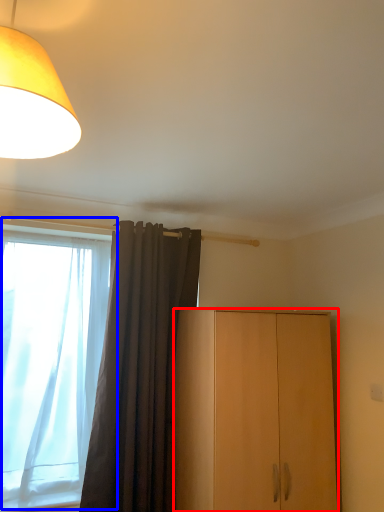
Question: Which object appears closest to the camera in this image, cabinetry (highlighted by a red box) or window (highlighted by a blue box)?

Choices:
 (A) cabinetry
 (B) window

Answer: (A)